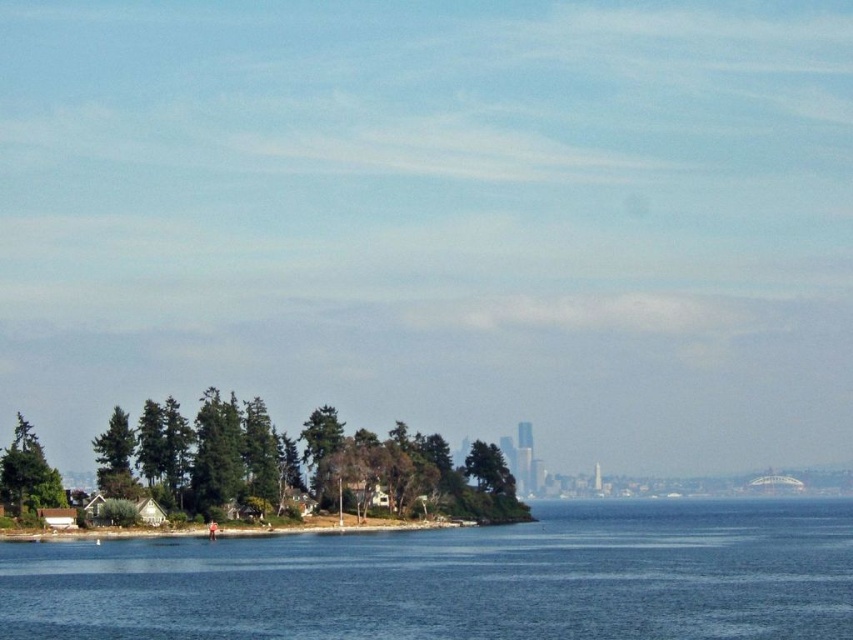
You are a bird flying over the coastal scene. You want to land on the tallest green matte tree. Which one should you choose between the green matte tree at lower left and the green matte tree at left?

The green matte tree at lower left is taller than the green matte tree at left, so you should choose the green matte tree at lower left.

You are standing on the beach and want to reach the blue water at lower center. Which direction should you walk relative to the green matte tree at lower left?

You should walk towards the blue water at lower center, which is located below the green matte tree at lower left, so you need to move downward from the tree towards the water.